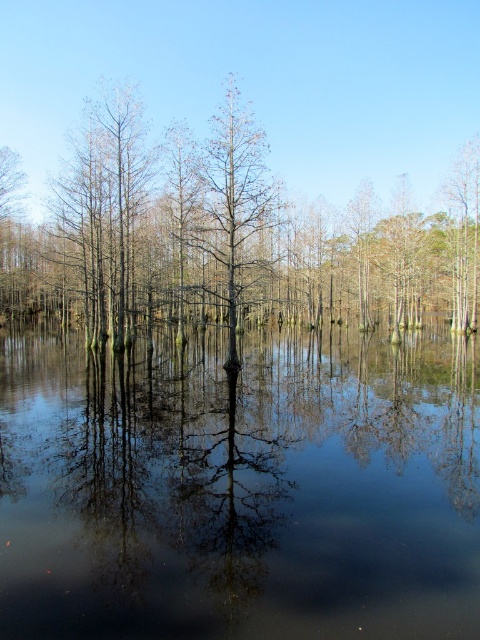
Question: Considering the relative positions of transparent water at center and brown matte tree at center in the image provided, where is transparent water at center located with respect to brown matte tree at center?

Choices:
 (A) below
 (B) above

Answer: (A)

Question: Which object is farther from the camera taking this photo?

Choices:
 (A) transparent water at center
 (B) brown matte tree at center

Answer: (B)

Question: Which point appears closest to the camera in this image?

Choices:
 (A) (24, 228)
 (B) (443, 442)

Answer: (B)

Question: Observing the image, what is the correct spatial positioning of transparent water at center in reference to brown matte tree at center?

Choices:
 (A) right
 (B) left

Answer: (A)

Question: Can you confirm if transparent water at center is positioned below brown matte tree at center?

Choices:
 (A) no
 (B) yes

Answer: (B)